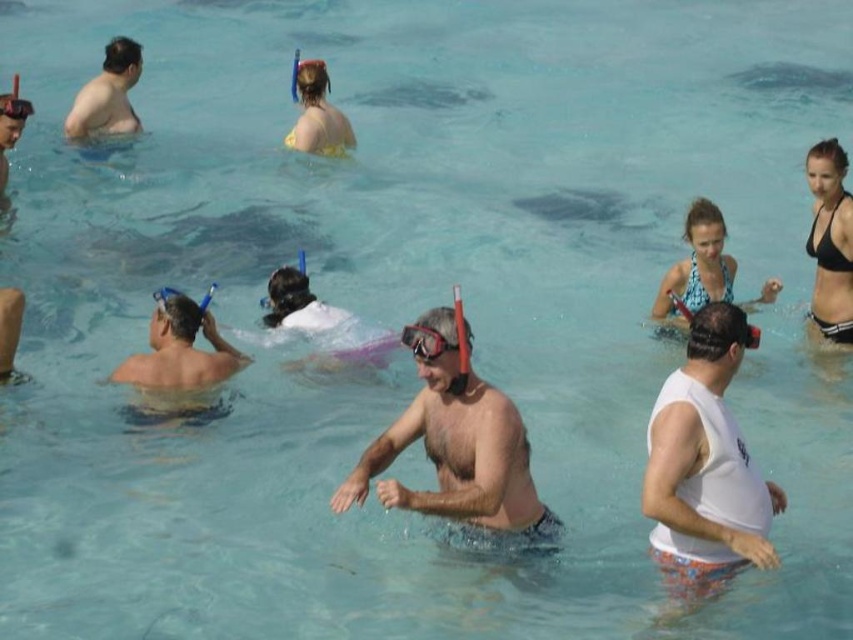
What are the coordinates of the white matte tank top at center?

The white matte tank top at center is located at point (x=705, y=464).

You are a photographer positioned at the edge of the water. You want to capture a photo of the smooth skin man at center and the yellow fabric snorkel at upper center without any obstruction. Based on their positions, which object should you focus on first to ensure both are in the frame?

The smooth skin man at center is in front of the yellow fabric snorkel at upper center. To ensure both are in the frame without obstruction, focus on the smooth skin man at center first, then adjust to include the yellow fabric snorkel at upper center behind him.

You are a swimmer who wants to know which object is wider between the white matte tank top at center and the transparent rubber goggles at center. Which one is wider?

The white matte tank top at center is wider than the transparent rubber goggles at center according to the description.